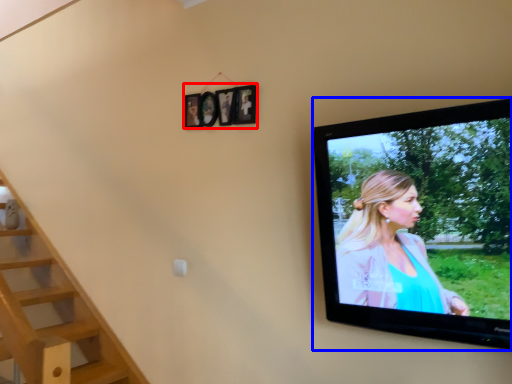
Question: Among these objects, which one is nearest to the camera, picture frame (highlighted by a red box) or television (highlighted by a blue box)?

Choices:
 (A) picture frame
 (B) television

Answer: (B)